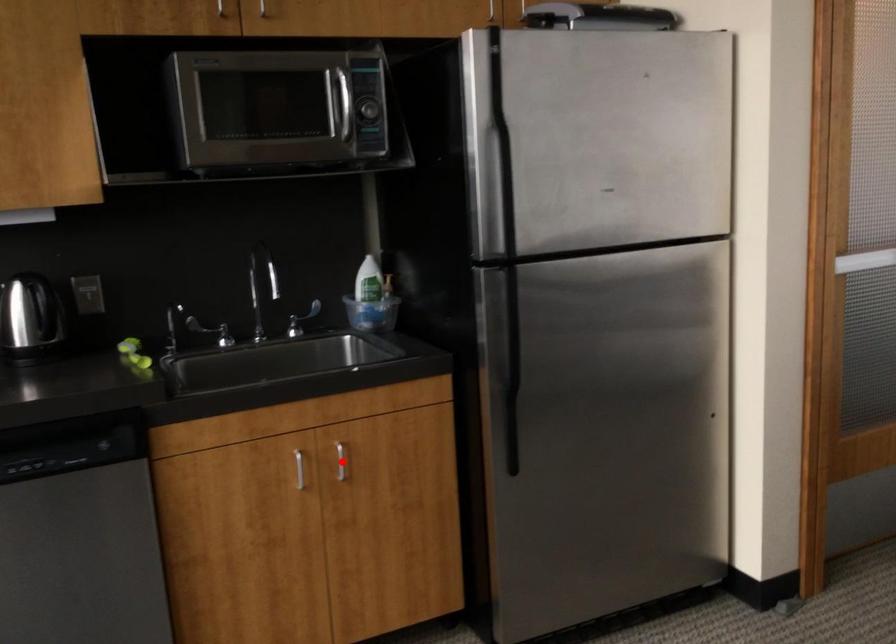
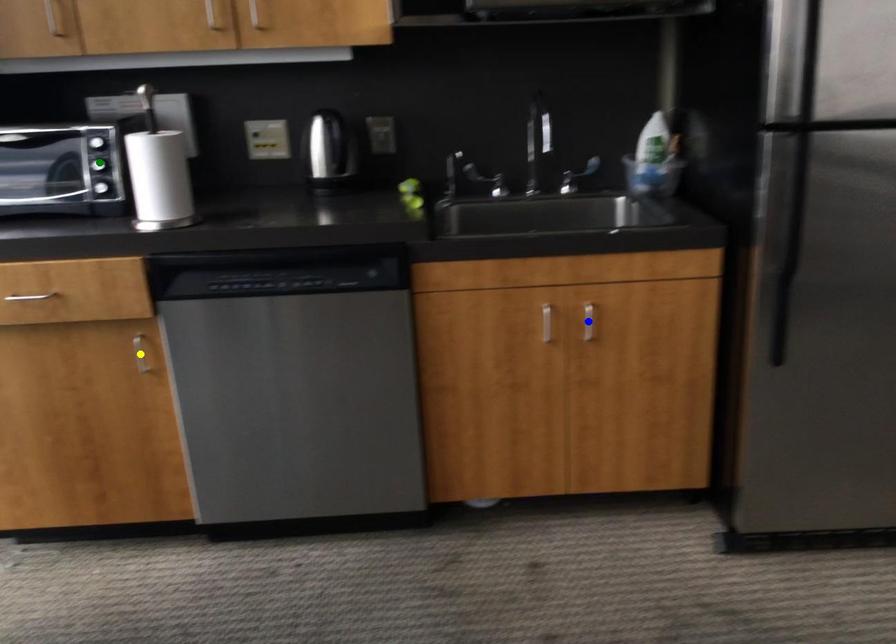
Question: I am providing you with two images of the same scene from different viewpoints. A red point is marked on the first image. You are given multiple points on the second image. Can you choose the point in image 2 that corresponds to the point in image 1?

Choices:
 (A) green point
 (B) blue point
 (C) yellow point

Answer: (B)